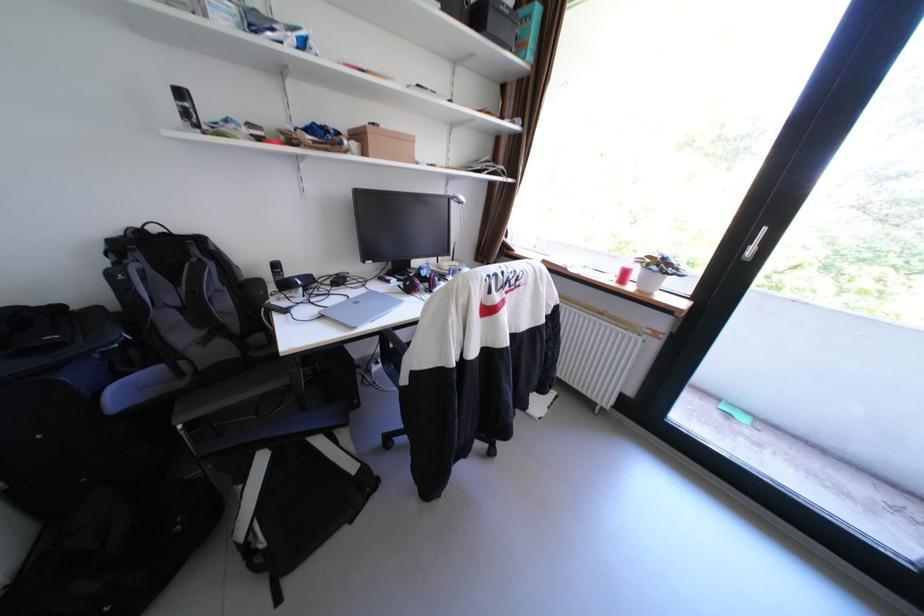
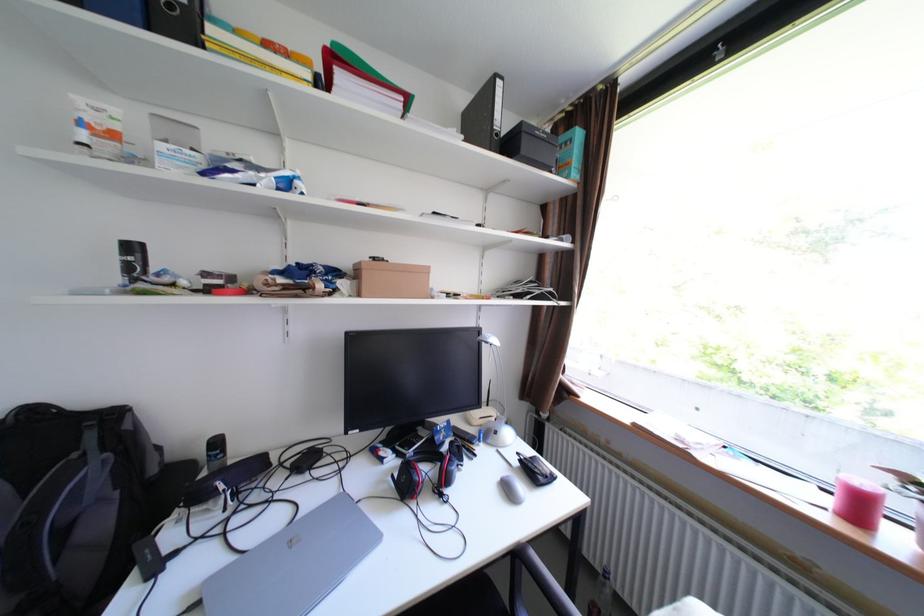
Where in the second image is the point corresponding to the point at 310,283 from the first image?

(233, 488)